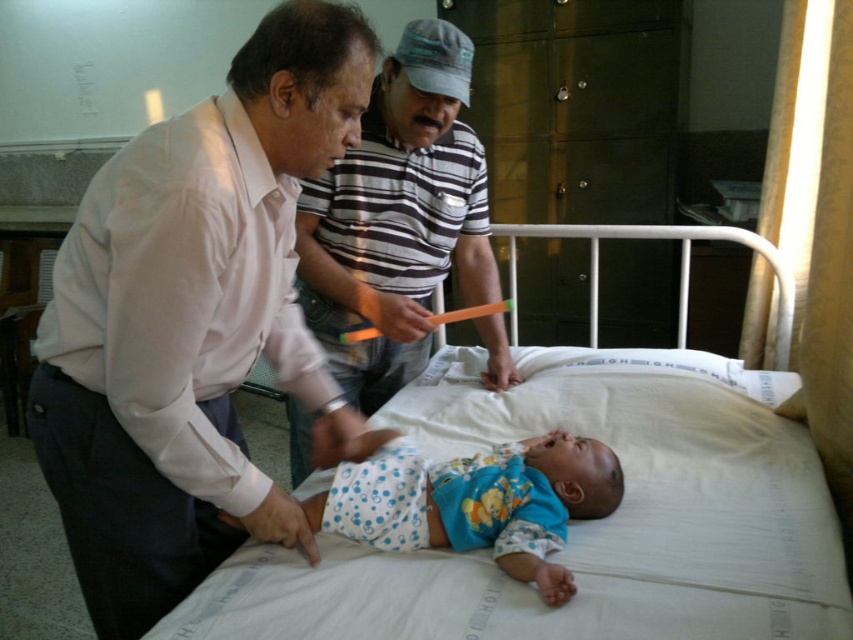
Question: Can you confirm if white shirt at center is positioned above white fabric bed at center?

Choices:
 (A) yes
 (B) no

Answer: (A)

Question: Which object is the farthest from the white fabric bed at center?

Choices:
 (A) blue dotted fabric diaper at center
 (B) blue dotted fabric at center
 (C) white shirt at center
 (D) striped cotton shirt at center

Answer: (C)

Question: Does white shirt at center come behind striped cotton shirt at center?

Choices:
 (A) no
 (B) yes

Answer: (A)

Question: Which of these objects is positioned farthest from the striped cotton shirt at center?

Choices:
 (A) white shirt at center
 (B) blue dotted fabric at center
 (C) white fabric bed at center

Answer: (B)

Question: Where is striped cotton shirt at center located in relation to blue dotted fabric diaper at center in the image?

Choices:
 (A) left
 (B) right

Answer: (B)

Question: Estimate the real-world distances between objects in this image. Which object is farther from the striped cotton shirt at center?

Choices:
 (A) white fabric bed at center
 (B) blue dotted fabric at center
 (C) white shirt at center

Answer: (B)